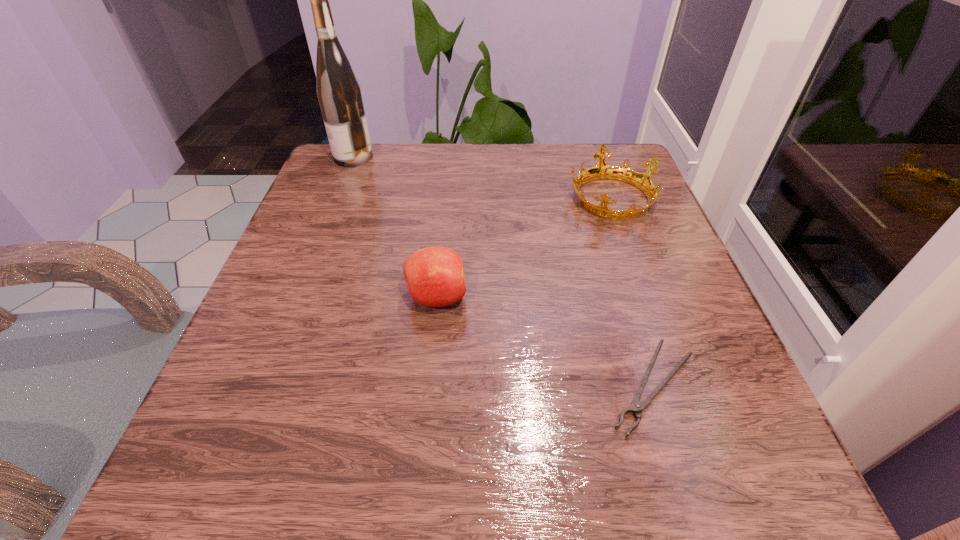
In order to click on object located at the near right corner in this screenshot , I will do `click(637, 406)`.

You are a GUI agent. You are given a task and a screenshot of the screen. Output one action in this format:
    pyautogui.click(x=<x>, y=<y>)
    Task: Click on the blank space at the far edge of the desktop
    
    Given the screenshot: What is the action you would take?
    pyautogui.click(x=451, y=147)

This screenshot has width=960, height=540. In the image, there is a desktop. What are the coordinates of `vacant space at the near edge` in the screenshot? It's located at [372, 444].

The width and height of the screenshot is (960, 540). Identify the location of free space at the left edge of the desktop. (309, 271).

In order to click on vacant space at the right edge of the desktop in this screenshot , I will do `click(601, 219)`.

Image resolution: width=960 pixels, height=540 pixels. Identify the location of free space at the near left corner of the desktop. (290, 469).

The image size is (960, 540). What are the coordinates of `free space at the far right corner of the desktop` in the screenshot? It's located at pos(624,152).

I want to click on free area in between the shortest object and the tallest object, so click(503, 272).

The height and width of the screenshot is (540, 960). Find the location of `unoccupied position between the wine bottle and the second shortest object`. unoccupied position between the wine bottle and the second shortest object is located at coordinates (482, 177).

Image resolution: width=960 pixels, height=540 pixels. Find the location of `free space between the second tallest object and the third tallest object`. free space between the second tallest object and the third tallest object is located at coordinates (523, 247).